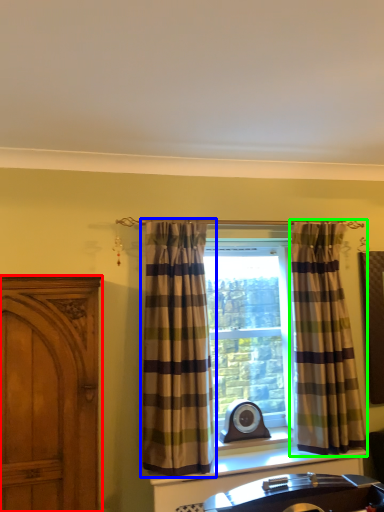
Question: Which object is the closest to the cabinetry (highlighted by a red box)? Choose among these: curtain (highlighted by a blue box) or curtain (highlighted by a green box).

Choices:
 (A) curtain
 (B) curtain

Answer: (A)